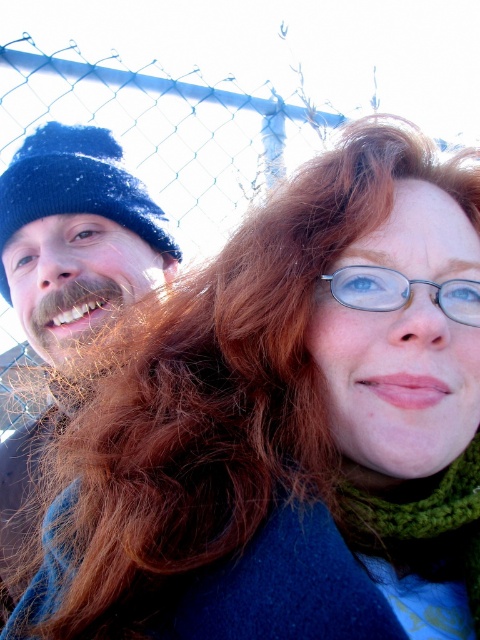
Question: Is dark blue knit hat at left below green knitted scarf at lower right?

Choices:
 (A) no
 (B) yes

Answer: (A)

Question: Which point appears closest to the camera in this image?

Choices:
 (A) (396, 289)
 (B) (92, 248)
 (C) (440, 579)

Answer: (A)

Question: Is dark blue knit hat at left positioned at the back of green knitted scarf at lower right?

Choices:
 (A) no
 (B) yes

Answer: (B)

Question: Which object is farther from the camera taking this photo?

Choices:
 (A) metallic silver glasses at upper center
 (B) green knitted scarf at lower right

Answer: (A)

Question: Which is farther from the metallic silver glasses at upper center?

Choices:
 (A) dark blue knit hat at left
 (B) green knitted scarf at lower right

Answer: (A)

Question: Does dark blue knit hat at left appear on the right side of green knitted scarf at lower right?

Choices:
 (A) no
 (B) yes

Answer: (A)